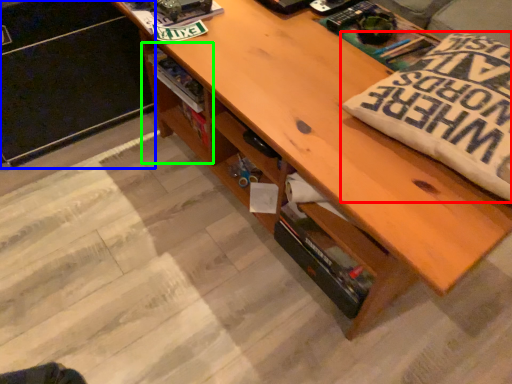
Question: Based on their relative distances, which object is farther from throw pillow (highlighted by a red box)? Choose from file cabinet (highlighted by a blue box) and shelf (highlighted by a green box).

Choices:
 (A) file cabinet
 (B) shelf

Answer: (A)